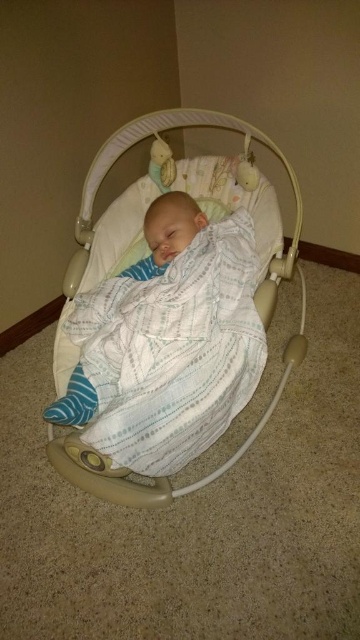
Question: Does beige fabric baby swing at center have a larger size compared to white textured blanket at center?

Choices:
 (A) no
 (B) yes

Answer: (B)

Question: Estimate the real-world distances between objects in this image. Which object is closer to the white textured blanket at center?

Choices:
 (A) beige fabric baby swing at center
 (B) soft plush toy at upper center

Answer: (B)

Question: Does white textured blanket at center have a larger size compared to soft plush toy at upper center?

Choices:
 (A) yes
 (B) no

Answer: (A)

Question: Which of these objects is positioned farthest from the beige fabric baby swing at center?

Choices:
 (A) soft plush toy at upper center
 (B) white textured blanket at center

Answer: (A)

Question: Which of these objects is positioned closest to the white textured blanket at center?

Choices:
 (A) soft plush toy at upper center
 (B) beige fabric baby swing at center

Answer: (A)

Question: From the image, what is the correct spatial relationship of beige fabric baby swing at center in relation to soft plush toy at upper center?

Choices:
 (A) above
 (B) below

Answer: (B)